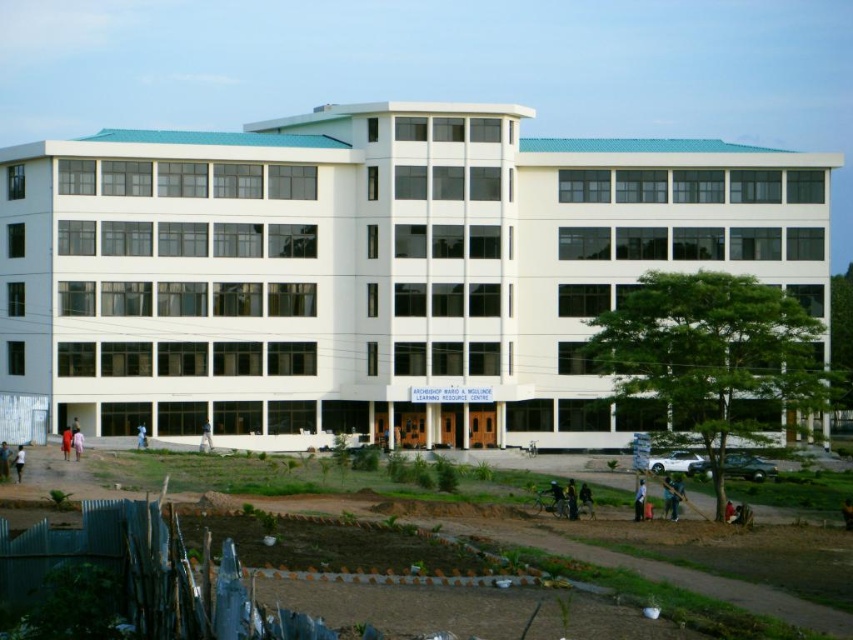
Question: Considering the relative positions of light pink fabric dress at lower left and red clothed person at lower right in the image provided, where is light pink fabric dress at lower left located with respect to red clothed person at lower right?

Choices:
 (A) above
 (B) below

Answer: (A)

Question: Which object is closer to the camera taking this photo?

Choices:
 (A) red fabric dress at lower left
 (B) blue fabric person at center
 (C) dark brown leather bag at lower center

Answer: (C)

Question: Which object is farther from the camera taking this photo?

Choices:
 (A) red clothed person at lower right
 (B) blue fabric person at center

Answer: (B)

Question: Which object is farther from the camera taking this photo?

Choices:
 (A) green fabric shirt at lower right
 (B) dark blue jeans at lower center

Answer: (B)

Question: Is white cotton pants at lower center further to camera compared to red fabric person at center?

Choices:
 (A) yes
 (B) no

Answer: (A)

Question: Does dark skin person at lower left appear under red fabric person at center?

Choices:
 (A) yes
 (B) no

Answer: (A)